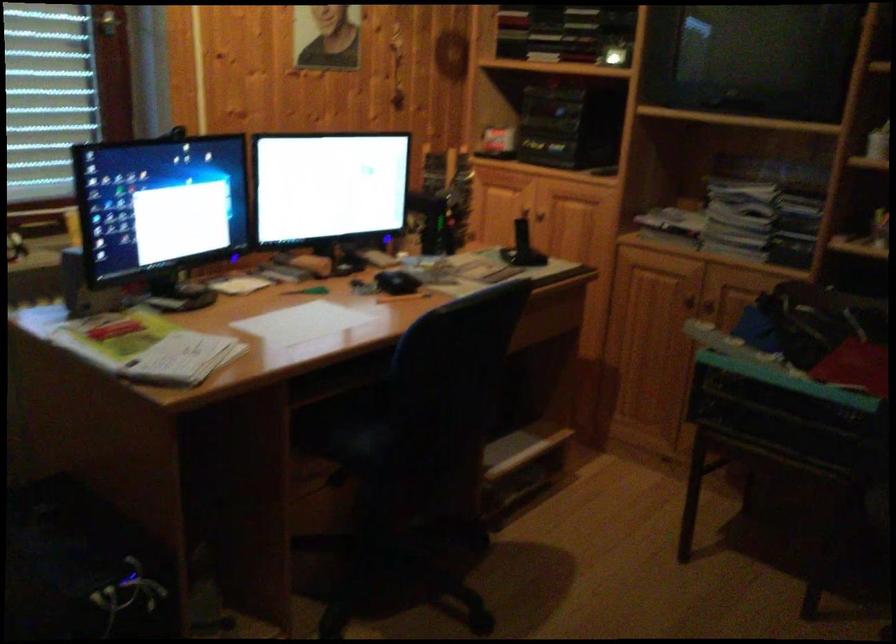
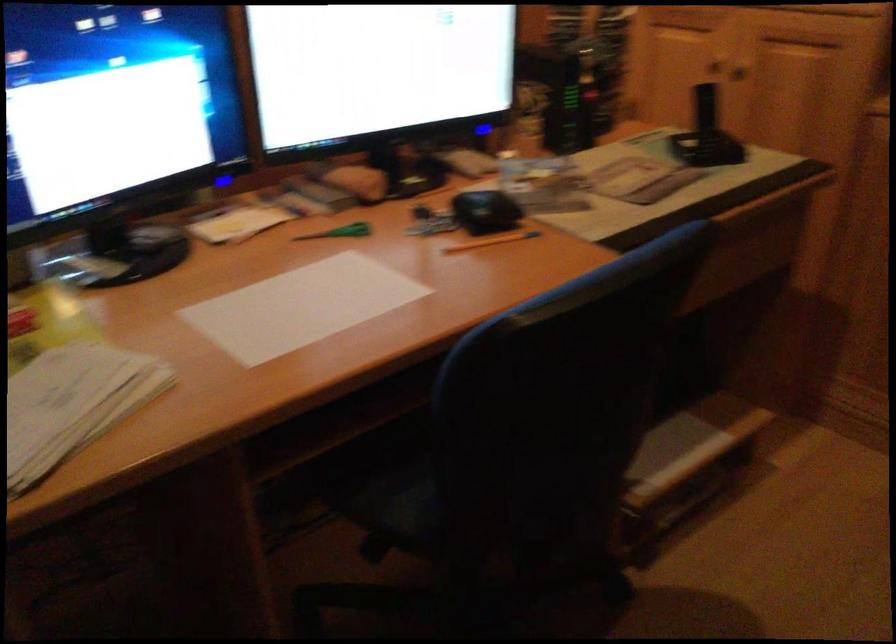
In the second image, find the point that corresponds to [546,214] in the first image.

(734, 76)